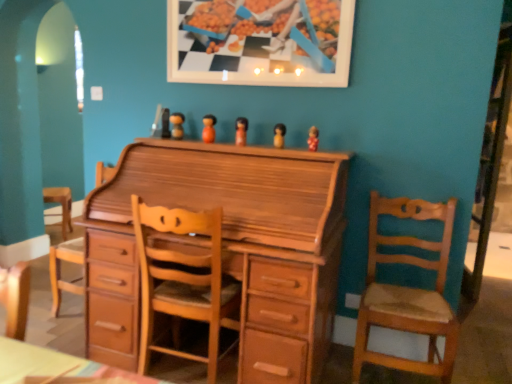
What do you see at coordinates (313, 139) in the screenshot?
I see `matte wooden figurine at center, which is the fifth toy from left to right` at bounding box center [313, 139].

What is the approximate width of brown wooden figurine at center, which ranks as the 4th toy in left-to-right order?

brown wooden figurine at center, which ranks as the 4th toy in left-to-right order, is 2.44 inches in width.

What do you see at coordinates (241, 131) in the screenshot?
I see `wooden figurine at center, marked as the third toy in a left-to-right arrangement` at bounding box center [241, 131].

Measure the distance between light brown wood chest of drawers at center and camera.

They are 1.66 meters apart.

The height and width of the screenshot is (384, 512). What do you see at coordinates (228, 247) in the screenshot? I see `light brown wood chest of drawers at center` at bounding box center [228, 247].

The height and width of the screenshot is (384, 512). Describe the element at coordinates (260, 42) in the screenshot. I see `wooden picture frame at upper center` at that location.

Locate an element on the screen. Image resolution: width=512 pixels, height=384 pixels. matte wooden figurine at center, which is the fifth toy from left to right is located at coordinates (313, 139).

What are the coordinates of `the 5th toy above the wooden chair at center, acting as the 1th chair starting from the left (from the image's perspective)` in the screenshot? It's located at (177, 125).

Is wooden figurine at center, arranged as the fifth toy when viewed from the right, to the left or to the right of wooden chair at center, which is the 2th chair in right-to-left order, in the image?

Answer: From the image, it's evident that wooden figurine at center, arranged as the fifth toy when viewed from the right, is to the left of wooden chair at center, which is the 2th chair in right-to-left order.

Does wooden figurine at center, which is the first toy from left to right, touch wooden chair at center, acting as the 1th chair starting from the left?

No, wooden figurine at center, which is the first toy from left to right, is not beside wooden chair at center, acting as the 1th chair starting from the left.

Based on the photo, could light brown wood chest of drawers at center be considered to be inside wooden figurine at center, marked as the third toy in a left-to-right arrangement?

Definitely not — light brown wood chest of drawers at center is not inside wooden figurine at center, marked as the third toy in a left-to-right arrangement.

Consider the image. Is wooden figurine at center, marked as the 3th toy in a right-to-left arrangement, positioned far away from light brown wood chest of drawers at center?

No.

From the image's perspective, which one is positioned lower, wooden figurine at center, marked as the third toy in a left-to-right arrangement, or light brown wood chest of drawers at center?

From the image's view, light brown wood chest of drawers at center is below.

Based on the photo, is wooden figurine at center, marked as the third toy in a left-to-right arrangement, oriented away from light brown wood chest of drawers at center?

wooden figurine at center, marked as the third toy in a left-to-right arrangement, is not turned away from light brown wood chest of drawers at center.

Looking at this image, between orange matte wooden doll at center, which is the 4th toy from right to left, and wooden picture frame at upper center, which one has smaller size?

Smaller between the two is orange matte wooden doll at center, which is the 4th toy from right to left.

Is orange matte wooden doll at center, which is the 4th toy from right to left, positioned beyond the bounds of wooden picture frame at upper center?

Yes.

From a real-world perspective, is orange matte wooden doll at center, which is the 4th toy from right to left, positioned under wooden picture frame at upper center based on gravity?

Correct, in the physical world, orange matte wooden doll at center, which is the 4th toy from right to left, is lower than wooden picture frame at upper center.

Which point is more distant from viewer, (309, 147) or (231, 184)?

The point (309, 147) is farther from the camera.

From the image's perspective, is matte wooden figurine at center, which is the fifth toy from left to right, located above or below light brown wood chest of drawers at center?

matte wooden figurine at center, which is the fifth toy from left to right, is situated higher than light brown wood chest of drawers at center in the image.

Measure the distance between matte wooden figurine at center, marked as the 1th toy in a right-to-left arrangement, and light brown wood chest of drawers at center.

matte wooden figurine at center, marked as the 1th toy in a right-to-left arrangement, is 29.82 inches away from light brown wood chest of drawers at center.

Does matte wooden figurine at center, marked as the 1th toy in a right-to-left arrangement, come in front of light brown wood chest of drawers at center?

No, the depth of matte wooden figurine at center, marked as the 1th toy in a right-to-left arrangement, is greater than that of light brown wood chest of drawers at center.

In the scene shown: Is wooden figurine at center, arranged as the fifth toy when viewed from the right, inside brown wooden figurine at center, which ranks as the 4th toy in left-to-right order?

Definitely not — wooden figurine at center, arranged as the fifth toy when viewed from the right, is not inside brown wooden figurine at center, which ranks as the 4th toy in left-to-right order.

Considering the sizes of objects brown wooden figurine at center, which is the second toy in right-to-left order, and wooden figurine at center, which is the first toy from left to right, in the image provided, who is smaller, brown wooden figurine at center, which is the second toy in right-to-left order, or wooden figurine at center, which is the first toy from left to right,?

brown wooden figurine at center, which is the second toy in right-to-left order, is smaller.

Is brown wooden figurine at center, which ranks as the 4th toy in left-to-right order, beside wooden figurine at center, arranged as the fifth toy when viewed from the right?

No, brown wooden figurine at center, which ranks as the 4th toy in left-to-right order, is not touching wooden figurine at center, arranged as the fifth toy when viewed from the right.

This screenshot has height=384, width=512. Find the location of `the 2nd toy positioned below the wooden figurine at center, which is the first toy from left to right (from a real-world perspective)`. the 2nd toy positioned below the wooden figurine at center, which is the first toy from left to right (from a real-world perspective) is located at coordinates (279, 135).

I want to click on the 1st toy to the left of the light brown wood chest of drawers at center, starting your count from the anchor, so click(209, 128).

Is orange matte wooden doll at center, which is the 4th toy from right to left, taller than light brown wood chest of drawers at center?

In fact, orange matte wooden doll at center, which is the 4th toy from right to left, may be shorter than light brown wood chest of drawers at center.

Which point is more forward, (207, 141) or (313, 182)?

The point (313, 182) is more forward.

Is orange matte wooden doll at center, which is the second toy in left-to-right order, oriented away from light brown wood chest of drawers at center?

No.

Is wooden picture frame at upper center positioned beyond the bounds of orange matte wooden doll at center, which is the 4th toy from right to left?

Yes, wooden picture frame at upper center is outside of orange matte wooden doll at center, which is the 4th toy from right to left.

From the picture: What's the angular difference between wooden picture frame at upper center and orange matte wooden doll at center, which is the 4th toy from right to left,'s facing directions?

0.0285 degrees separate the facing orientations of wooden picture frame at upper center and orange matte wooden doll at center, which is the 4th toy from right to left.

Is wooden picture frame at upper center at the left side of orange matte wooden doll at center, which is the 4th toy from right to left?

No, wooden picture frame at upper center is not to the left of orange matte wooden doll at center, which is the 4th toy from right to left.

Between wooden picture frame at upper center and orange matte wooden doll at center, which is the second toy in left-to-right order, which one has more height?

Standing taller between the two is wooden picture frame at upper center.

The image size is (512, 384). Find the location of `toy that appears on the left of wooden chair at center, acting as the 1th chair starting from the left`. toy that appears on the left of wooden chair at center, acting as the 1th chair starting from the left is located at coordinates (177, 125).

Identify the location of chest of drawers below the wooden figurine at center, marked as the 3th toy in a right-to-left arrangement (from a real-world perspective). The height and width of the screenshot is (384, 512). (228, 247).

From the image, which object appears to be nearer to brown wooden figurine at center, which is the second toy in right-to-left order, matte wooden figurine at center, marked as the 1th toy in a right-to-left arrangement, or wooden chair at center, acting as the 1th chair starting from the left?

Among the two, matte wooden figurine at center, marked as the 1th toy in a right-to-left arrangement, is located nearer to brown wooden figurine at center, which is the second toy in right-to-left order.

When comparing their distances from wooden figurine at center, which is the first toy from left to right, does wooden picture frame at upper center or matte wooden figurine at center, marked as the 1th toy in a right-to-left arrangement, seem closer?

wooden picture frame at upper center.

From the image, which object appears to be farther from wooden figurine at center, marked as the third toy in a left-to-right arrangement, wooden picture frame at upper center or light brown wooden chair at right, the second chair viewed from the left?

The object further to wooden figurine at center, marked as the third toy in a left-to-right arrangement, is light brown wooden chair at right, the second chair viewed from the left.

Based on their spatial positions, is wooden figurine at center, marked as the 3th toy in a right-to-left arrangement, or wooden chair at center, which is the 2th chair in right-to-left order, further from brown wooden figurine at center, which ranks as the 4th toy in left-to-right order?

wooden chair at center, which is the 2th chair in right-to-left order.

When comparing their distances from light brown wood chest of drawers at center, does matte wooden figurine at center, marked as the 1th toy in a right-to-left arrangement, or light brown wooden chair at right, marked as the first chair in a right-to-left arrangement, seem closer?

light brown wooden chair at right, marked as the first chair in a right-to-left arrangement, lies closer to light brown wood chest of drawers at center than the other object.

Based on the photo, estimate the real-world distances between objects in this image. Which object is further from wooden figurine at center, which is the first toy from left to right, wooden chair at center, acting as the 1th chair starting from the left, or wooden picture frame at upper center?

wooden chair at center, acting as the 1th chair starting from the left.

Looking at the image, which one is located further to light brown wood chest of drawers at center, light brown wood swivel chair at center or wooden picture frame at upper center?

Based on the image, light brown wood swivel chair at center appears to be further to light brown wood chest of drawers at center.

Considering their positions, is wooden figurine at center, marked as the third toy in a left-to-right arrangement, positioned further to light brown wooden chair at right, the second chair viewed from the left, than matte wooden figurine at center, marked as the 1th toy in a right-to-left arrangement?

The object further to light brown wooden chair at right, the second chair viewed from the left, is wooden figurine at center, marked as the third toy in a left-to-right arrangement.

You are a GUI agent. You are given a task and a screenshot of the screen. Output one action in this format:
    pyautogui.click(x=<x>, y=<y>)
    Task: Click on the swivel chair between light brown wood chest of drawers at center and wooden figurine at center, which is the first toy from left to right, from front to back
    This screenshot has width=512, height=384.
    Given the screenshot: What is the action you would take?
    pyautogui.click(x=60, y=270)

Where is `the chest of drawers situated between orange matte wooden doll at center, which is the 4th toy from right to left, and light brown wooden chair at right, the second chair viewed from the left, from left to right`? the chest of drawers situated between orange matte wooden doll at center, which is the 4th toy from right to left, and light brown wooden chair at right, the second chair viewed from the left, from left to right is located at coordinates (228, 247).

Locate an element on the screen. The image size is (512, 384). chest of drawers between wooden figurine at center, arranged as the fifth toy when viewed from the right, and wooden chair at center, which is the 2th chair in right-to-left order, in the up-down direction is located at coordinates (228, 247).

Find the location of a particular element. the chest of drawers between wooden picture frame at upper center and light brown wooden chair at right, marked as the first chair in a right-to-left arrangement, vertically is located at coordinates (228, 247).